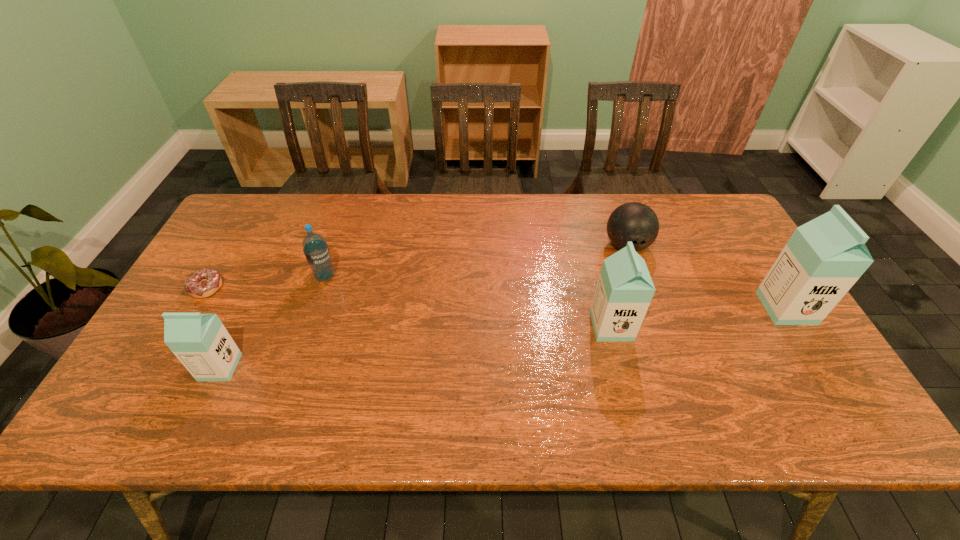
To achieve even spacing by inserting another milk_can among them, please point to a vacant spot for this new milk_can. Please provide its 2D coordinates. Your answer should be formatted as a tuple, i.e. [(x, y)], where the tuple contains the x and y coordinates of a point satisfying the conditions above.

[(423, 346)]